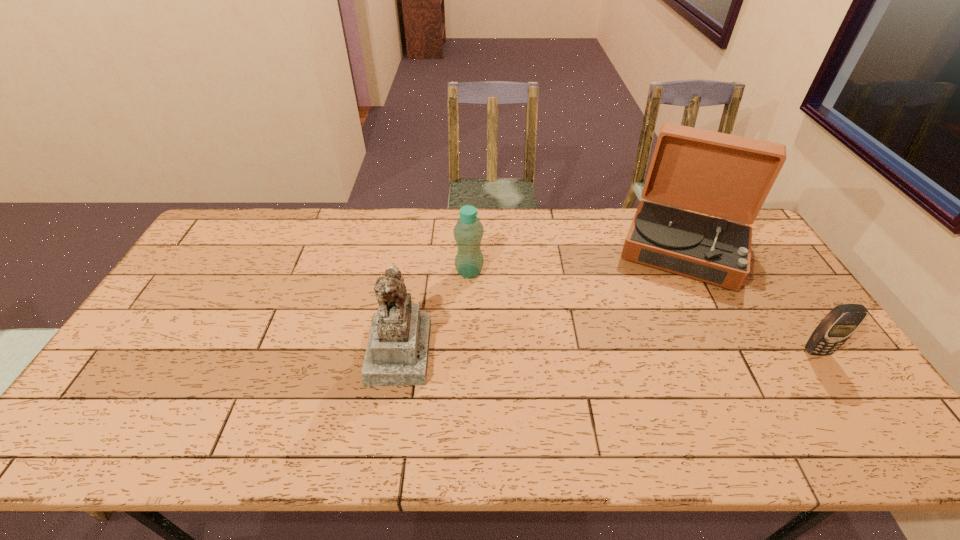
Locate an element on the screen. Image resolution: width=960 pixels, height=540 pixels. figurine is located at coordinates coord(397,354).

Identify the location of cellular telephone. The image size is (960, 540). (842, 321).

At what (x,y) coordinates should I click in order to perform the action: click on phonograph record. Please return your answer as a coordinate pair (x, y). Looking at the image, I should click on (727, 176).

Where is `the second shortest object`? the second shortest object is located at coordinates (468, 232).

Locate an element on the screen. the second object from left to right is located at coordinates (468, 232).

Where is `vacant space located 0.220m on the front-facing side of the figurine`? vacant space located 0.220m on the front-facing side of the figurine is located at coordinates (512, 350).

At what (x,y) coordinates should I click in order to perform the action: click on free space located 0.090m on the front face of the shortest object. Please return your answer as a coordinate pair (x, y). The width and height of the screenshot is (960, 540). Looking at the image, I should click on (840, 387).

Where is `free location located 0.050m on the face of the phonograph record`? This screenshot has height=540, width=960. free location located 0.050m on the face of the phonograph record is located at coordinates (670, 300).

You are a GUI agent. You are given a task and a screenshot of the screen. Output one action in this format:
    pyautogui.click(x=<x>, y=<y>)
    Task: Click on the vacant space located 0.070m on the face of the phonograph record
    This screenshot has height=540, width=960.
    Given the screenshot: What is the action you would take?
    pyautogui.click(x=669, y=304)

Image resolution: width=960 pixels, height=540 pixels. Find the location of `free region located 0.150m on the face of the phonograph record`. free region located 0.150m on the face of the phonograph record is located at coordinates (664, 323).